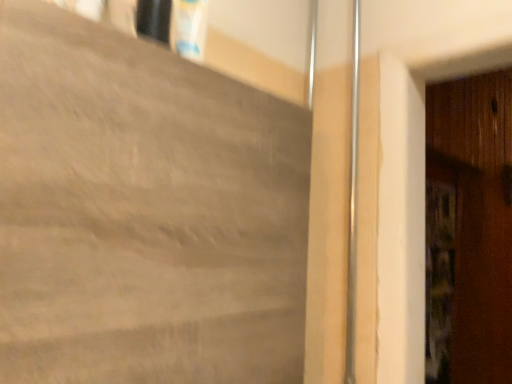
The height and width of the screenshot is (384, 512). What are the coordinates of `matte cardboard at upper left` in the screenshot? It's located at (144, 213).

What do you see at coordinates (144, 213) in the screenshot?
I see `matte cardboard at upper left` at bounding box center [144, 213].

I want to click on matte cardboard at upper left, so click(x=144, y=213).